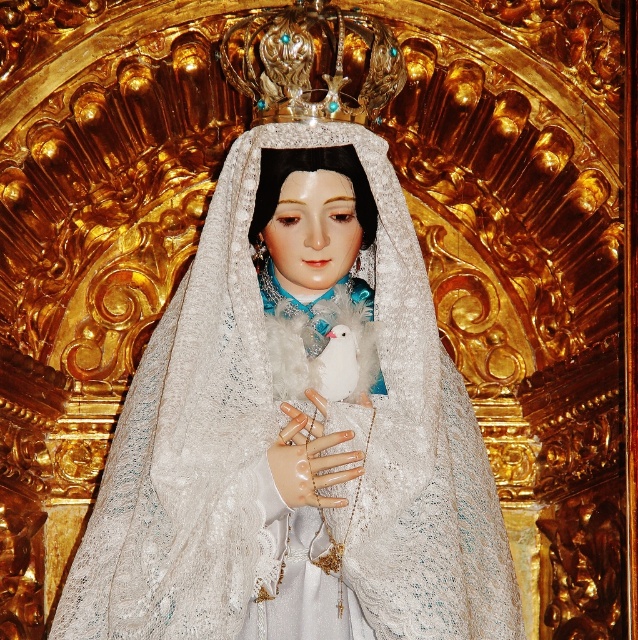
A sculptor wants to place a small golden ring on the smooth porcelain hand at center. The ring has a diameter of 2 centimeters. Given the coordinates of the hand, can the sculptor accurately position the ring without overlapping any other elements in the scene?

The smooth porcelain hand at center is positioned at coordinates point (309,461). Since the ring has a diameter of 2 centimeters, the sculptor can accurately place it on the hand without overlapping other elements as long as there is sufficient space at that coordinate location.

You are an art conservator examining the statue. You notice two points on the statue, one at point (353, 596) and another at point (325, 384). Which point is closer to the viewer?

Point (353, 596) is in front of point (325, 384), so it is closer to the viewer.

You are an art conservator tasked with placing a protective glass shield around both the smooth porcelain hand at center and the white fluffy bird at center. The shield must be a circular shape with a diameter of 5 meters. Will the shield fully enclose both objects without any overlap or gaps?

The smooth porcelain hand at center is 4.60 meters from the white fluffy bird at center. Since the distance between them is less than the diameter of the shield, which is 5 meters, the circular shield will fully enclose both objects without any overlap or gaps.